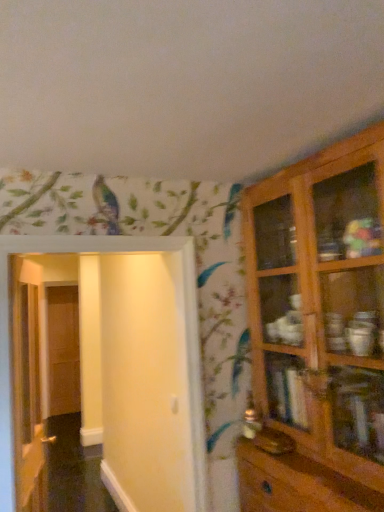
Question: Is wooden door at left, arranged as the 3th door when viewed from the front, taller than wooden cabinet at right?

Choices:
 (A) no
 (B) yes

Answer: (B)

Question: From a real-world perspective, is wooden door at left, arranged as the 3th door when viewed from the front, on top of wooden cabinet at right?

Choices:
 (A) yes
 (B) no

Answer: (B)

Question: Is wooden door at left, arranged as the 3th door when viewed from the front, beside wooden cabinet at right?

Choices:
 (A) yes
 (B) no

Answer: (B)

Question: Considering the relative positions of wooden door at left, placed as the 1th door when sorted from back to front, and wooden cabinet at right in the image provided, is wooden door at left, placed as the 1th door when sorted from back to front, to the right of wooden cabinet at right from the viewer's perspective?

Choices:
 (A) no
 (B) yes

Answer: (A)

Question: Is wooden door at left, arranged as the 3th door when viewed from the front, positioned with its back to wooden cabinet at right?

Choices:
 (A) no
 (B) yes

Answer: (A)

Question: Is wooden cabinet at right taller or shorter than white glossy door at left, positioned as the 2th door in left-to-right order?

Choices:
 (A) tall
 (B) short

Answer: (A)

Question: From the image's perspective, is wooden cabinet at right positioned above or below white glossy door at left, which is the 2th door from back to front?

Choices:
 (A) above
 (B) below

Answer: (A)

Question: Is point (360, 231) positioned closer to the camera than point (18, 336)?

Choices:
 (A) farther
 (B) closer

Answer: (B)

Question: Considering the relative positions of wooden cabinet at right and white glossy door at left, which is the 2th door from back to front, in the image provided, is wooden cabinet at right to the left or to the right of white glossy door at left, which is the 2th door from back to front,?

Choices:
 (A) right
 (B) left

Answer: (A)

Question: Is white glossy door at left, which is the 2th door in front-to-back order, situated inside wooden cabinet at right or outside?

Choices:
 (A) outside
 (B) inside

Answer: (A)

Question: From a real-world perspective, is white glossy door at left, positioned as the 2th door in left-to-right order, positioned above or below wooden cabinet at right?

Choices:
 (A) above
 (B) below

Answer: (B)

Question: In the image, is white glossy door at left, positioned as the 2th door in left-to-right order, positioned in front of or behind wooden cabinet at right?

Choices:
 (A) behind
 (B) front

Answer: (A)

Question: Is point (28, 498) positioned closer to the camera than point (243, 476)?

Choices:
 (A) farther
 (B) closer

Answer: (A)

Question: In the image, is white glossy door at left, positioned as the 2th door in left-to-right order, on the left side or the right side of wooden door at left, the first door from the left?

Choices:
 (A) left
 (B) right

Answer: (B)

Question: In terms of width, does white glossy door at left, positioned as the 2th door in left-to-right order, look wider or thinner when compared to wooden door at left, placed as the 1th door when sorted from back to front?

Choices:
 (A) thin
 (B) wide

Answer: (A)